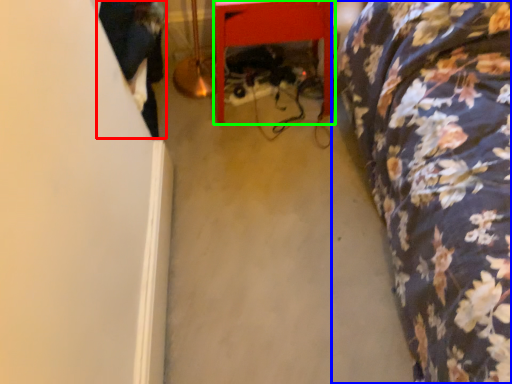
Question: Which is nearer to the couple (highlighted by a red box)? furniture (highlighted by a blue box) or furniture (highlighted by a green box).

Choices:
 (A) furniture
 (B) furniture

Answer: (B)